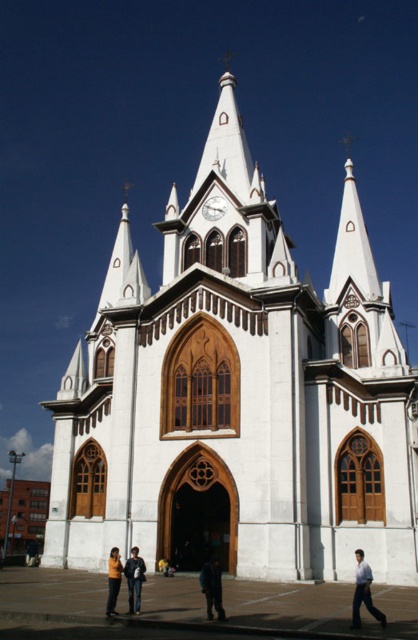
Does yellow leather jacket at center come in front of orange fabric jacket at lower center?

No, it is behind orange fabric jacket at lower center.

Is yellow leather jacket at center taller than orange fabric jacket at lower center?

Incorrect, yellow leather jacket at center's height is not larger of orange fabric jacket at lower center's.

Image resolution: width=418 pixels, height=640 pixels. Find the location of `yellow leather jacket at center`. yellow leather jacket at center is located at coordinates (135, 579).

Where is `yellow leather jacket at center`? yellow leather jacket at center is located at coordinates (135, 579).

Who is positioned more to the right, dark blue fabric jacket at center or orange fabric jacket at lower center?

dark blue fabric jacket at center

Identify the location of dark blue fabric jacket at center. Image resolution: width=418 pixels, height=640 pixels. (211, 588).

Who is more forward, (219,573) or (116,595)?

Positioned in front is point (219,573).

Identify the location of dark blue fabric jacket at center. (211, 588).

Does dark blue fabric jacket at center lie in front of yellow leather jacket at center?

Yes, it is.

Is point (206, 564) behind point (130, 560)?

No, it is not.

Who is more forward, (209, 568) or (134, 602)?

Point (209, 568) is in front.

What are the coordinates of `dark blue fabric jacket at center` in the screenshot? It's located at (211, 588).